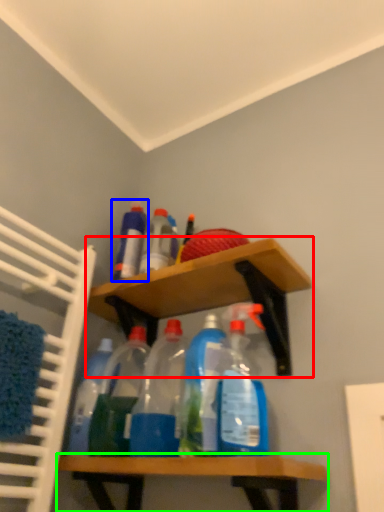
Question: Which object is positioned closest to shelf (highlighted by a red box)? Select from bottle (highlighted by a blue box) and shelf (highlighted by a green box).

Choices:
 (A) bottle
 (B) shelf

Answer: (A)